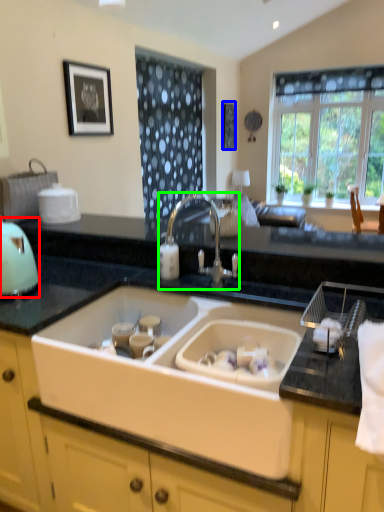
Question: Estimate the real-world distances between objects in this image. Which object is closer to appliance (highlighted by a red box), picture frame (highlighted by a blue box) or tap (highlighted by a green box)?

Choices:
 (A) picture frame
 (B) tap

Answer: (B)